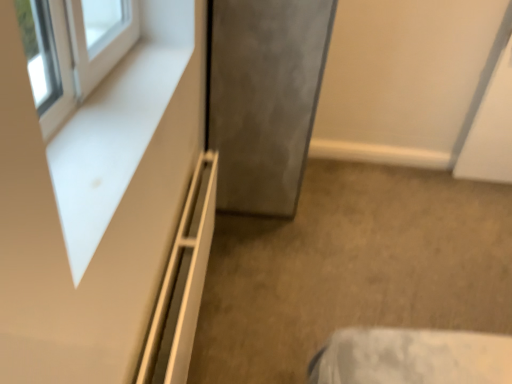
What are the coordinates of `white matte dresser at upper left` in the screenshot? It's located at (105, 196).

What do you see at coordinates (182, 283) in the screenshot? I see `white matte shelf at lower left` at bounding box center [182, 283].

Locate an element on the screen. The image size is (512, 384). satin gray door at center is located at coordinates (264, 98).

Can you tell me how much white matte shelf at lower left and satin gray door at center differ in facing direction?

They differ by 0.498 degrees in their facing directions.

Are white matte shelf at lower left and satin gray door at center making contact?

No, white matte shelf at lower left is not touching satin gray door at center.

Based on the photo, who is bigger, white matte shelf at lower left or satin gray door at center?

Bigger between the two is satin gray door at center.

From the picture: Which object is thinner, white matte dresser at upper left or satin gray door at center?

With smaller width is white matte dresser at upper left.

Is white matte dresser at upper left situated inside satin gray door at center or outside?

white matte dresser at upper left is not inside satin gray door at center, it's outside.

Which point is more forward, (178, 202) or (239, 203)?

Positioned in front is point (178, 202).

Is satin gray door at center positioned in front of white matte shelf at lower left?

No, the depth of satin gray door at center is greater than that of white matte shelf at lower left.

Can you tell me how much satin gray door at center and white matte shelf at lower left differ in facing direction?

They differ by 0.498 degrees in their facing directions.

Can white matte shelf at lower left be found inside satin gray door at center?

Definitely not — white matte shelf at lower left is not inside satin gray door at center.

From the image's perspective, which object appears higher, satin gray door at center or white matte shelf at lower left?

From the image's view, satin gray door at center is above.

From the image's perspective, between white matte shelf at lower left and white matte dresser at upper left, who is located below?

white matte shelf at lower left appears lower in the image.

Is white matte shelf at lower left oriented towards white matte dresser at upper left?

No, white matte shelf at lower left is not turned towards white matte dresser at upper left.

Based on their positions, is white matte shelf at lower left located to the left or right of white matte dresser at upper left?

Clearly, white matte shelf at lower left is on the right of white matte dresser at upper left in the image.

Is white matte shelf at lower left beside white matte dresser at upper left?

They are not placed beside each other.

From a real-world perspective, is white matte dresser at upper left physically below white matte shelf at lower left?

Incorrect, from a real-world perspective, white matte dresser at upper left is higher than white matte shelf at lower left.

Would you consider white matte dresser at upper left to be distant from white matte shelf at lower left?

white matte dresser at upper left is actually quite close to white matte shelf at lower left.

Is white matte dresser at upper left positioned with its back to white matte shelf at lower left?

No, white matte dresser at upper left is not facing away from white matte shelf at lower left.

From the image's perspective, does white matte dresser at upper left appear lower than white matte shelf at lower left?

Incorrect, from the image's perspective, white matte dresser at upper left is higher than white matte shelf at lower left.

Based on the photo, is satin gray door at center next to white matte dresser at upper left and touching it?

No, satin gray door at center is not with white matte dresser at upper left.

Considering the sizes of objects satin gray door at center and white matte dresser at upper left in the image provided, who is thinner, satin gray door at center or white matte dresser at upper left?

Thinner between the two is white matte dresser at upper left.

Is white matte dresser at upper left completely or partially inside satin gray door at center?

Actually, white matte dresser at upper left is outside satin gray door at center.

Is satin gray door at center facing towards white matte dresser at upper left?

No.

What are the coordinates of `shelf that is below the satin gray door at center (from the image's perspective)` in the screenshot? It's located at (182, 283).

Locate an element on the screen. This screenshot has width=512, height=384. door behind the white matte dresser at upper left is located at coordinates (264, 98).

When comparing their distances from satin gray door at center, does white matte dresser at upper left or white matte shelf at lower left seem closer?

white matte shelf at lower left lies closer to satin gray door at center than the other object.

From the image, which object appears to be nearer to satin gray door at center, white matte shelf at lower left or white matte dresser at upper left?

The object closer to satin gray door at center is white matte shelf at lower left.

Considering their positions, is satin gray door at center positioned further to white matte shelf at lower left than white matte dresser at upper left?

Based on the image, satin gray door at center appears to be further to white matte shelf at lower left.

Considering their positions, is satin gray door at center positioned closer to white matte dresser at upper left than white matte shelf at lower left?

white matte shelf at lower left is closer to white matte dresser at upper left.

When comparing their distances from white matte shelf at lower left, does white matte dresser at upper left or satin gray door at center seem further?

satin gray door at center lies further to white matte shelf at lower left than the other object.

From the image, which object appears to be nearer to white matte dresser at upper left, white matte shelf at lower left or satin gray door at center?

The object closer to white matte dresser at upper left is white matte shelf at lower left.

You are a GUI agent. You are given a task and a screenshot of the screen. Output one action in this format:
    pyautogui.click(x=<x>, y=<y>)
    Task: Click on the shelf between white matte dresser at upper left and satin gray door at center along the z-axis
    
    Given the screenshot: What is the action you would take?
    pyautogui.click(x=182, y=283)